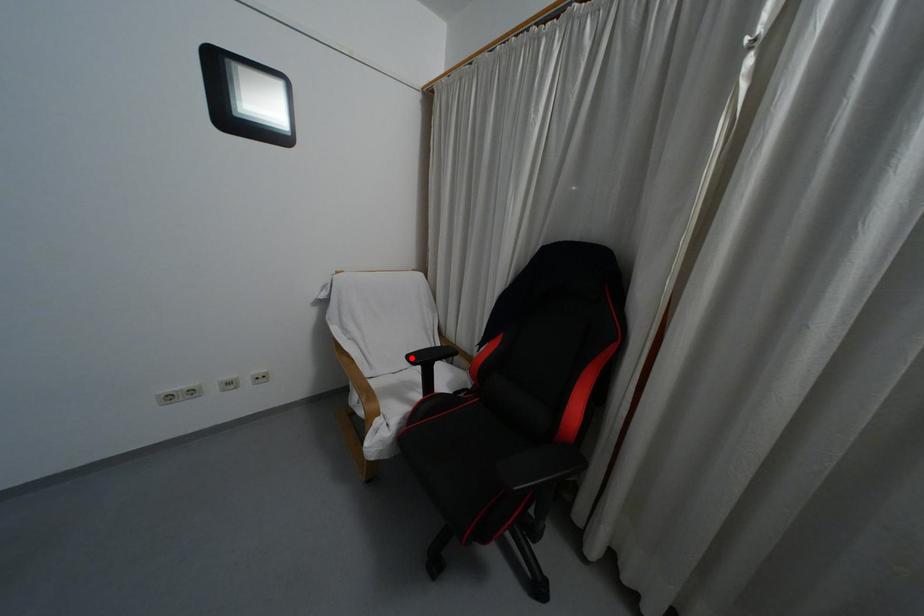
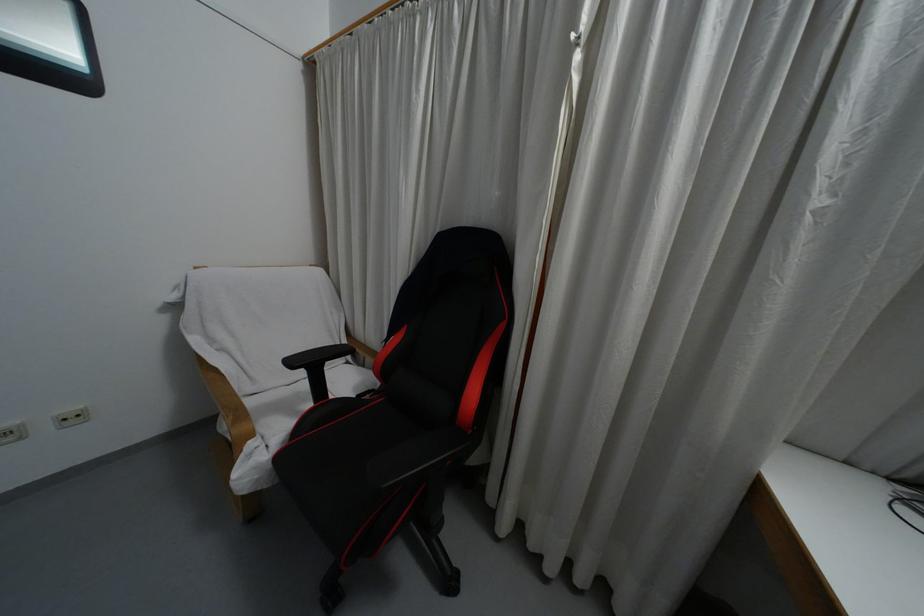
Question: I am providing you with two images of the same scene from different viewpoints. A red point is shown in image1. For the corresponding object point in image2, is it positioned nearer or farther from the camera?

Choices:
 (A) Nearer
 (B) Farther

Answer: (B)